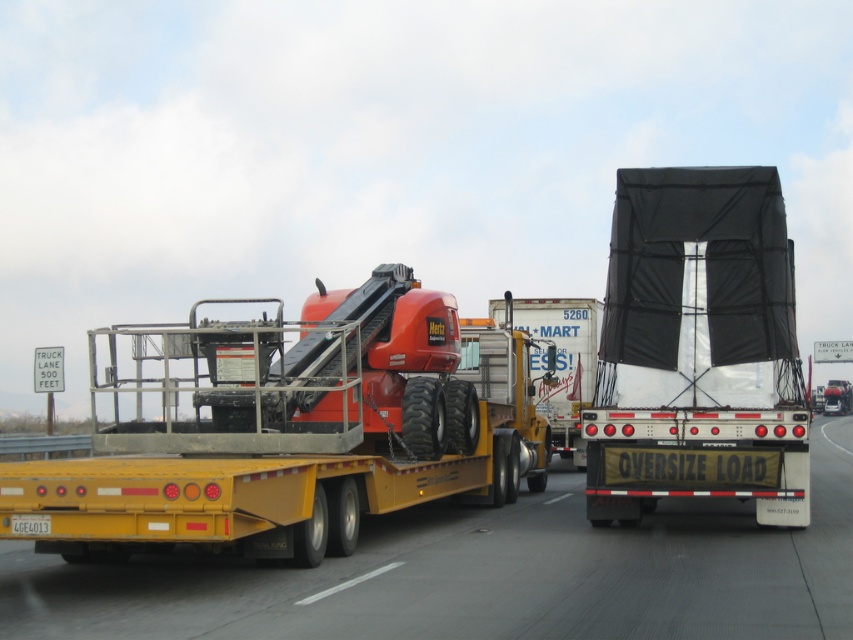
Question: Which is farther from the yellow metallic flatbed trailer at center?

Choices:
 (A) matte orange tow truck at center
 (B) black mesh truck at center
 (C) white plastic license plate at lower left

Answer: (C)

Question: Which object is the farthest from the black mesh truck at center?

Choices:
 (A) white plastic license plate at lower left
 (B) matte orange tow truck at center

Answer: (A)

Question: Where is black mesh truck at center located in relation to white plastic license plate at lower left in the image?

Choices:
 (A) below
 (B) above

Answer: (B)

Question: Is matte orange tow truck at center further to camera compared to white plastic license plate at lower left?

Choices:
 (A) yes
 (B) no

Answer: (B)

Question: Is the position of black mesh truck at center less distant than that of white plastic license plate at lower left?

Choices:
 (A) no
 (B) yes

Answer: (A)

Question: Based on their relative distances, which object is farther from the white plastic license plate at lower left?

Choices:
 (A) matte orange tow truck at center
 (B) black mesh truck at center
 (C) yellow metallic flatbed trailer at center

Answer: (B)